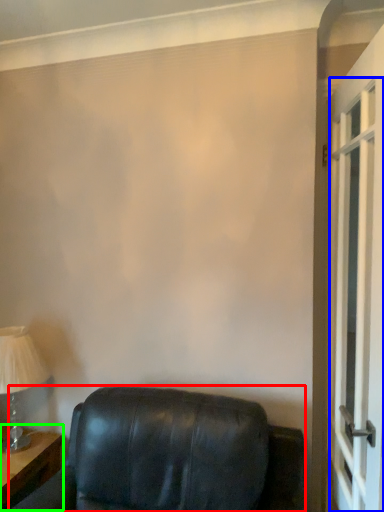
Question: Which object is the closest to the furniture (highlighted by a red box)? Choose among these: screen door (highlighted by a blue box) or table (highlighted by a green box).

Choices:
 (A) screen door
 (B) table

Answer: (B)